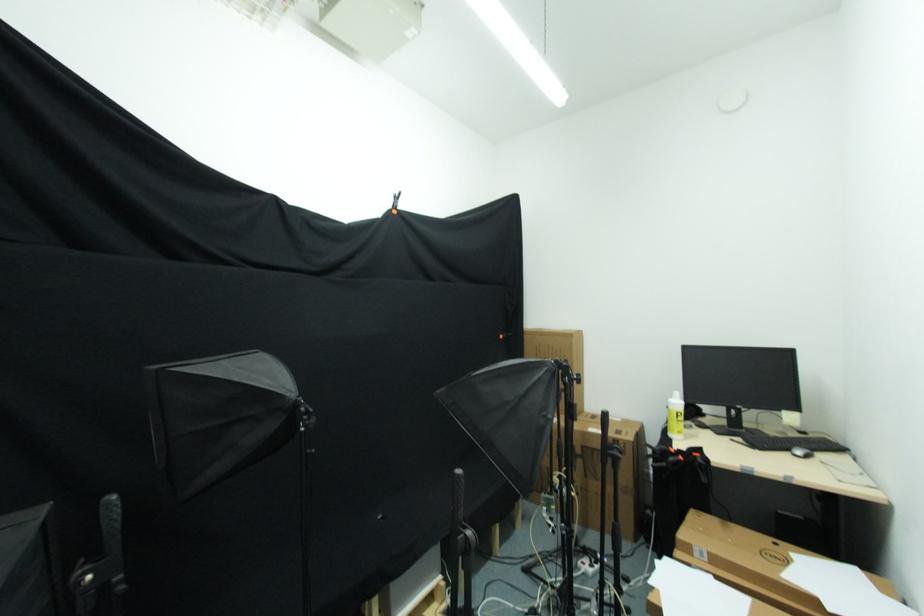
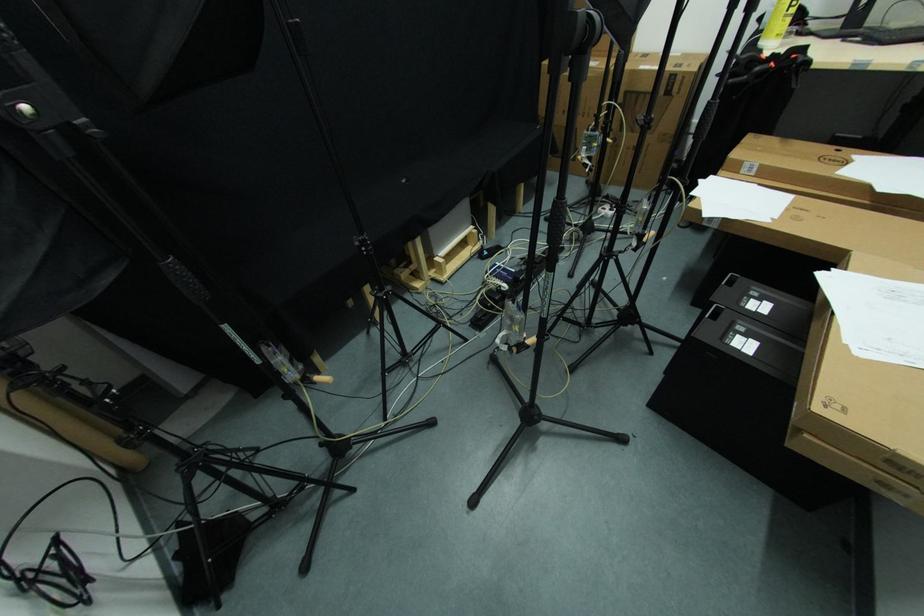
Locate, in the second image, the point that corresponds to [682,418] in the first image.

(796, 6)